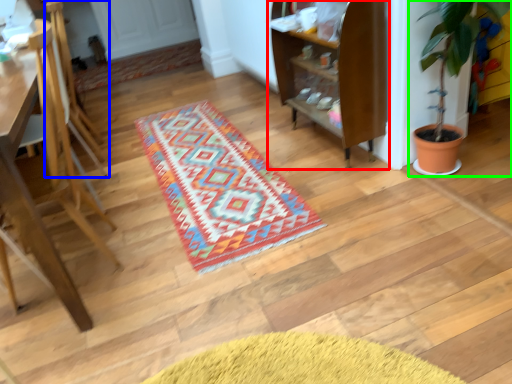
Question: Which object is positioned farthest from shelf (highlighted by a red box)? Select from armchair (highlighted by a blue box) and houseplant (highlighted by a green box).

Choices:
 (A) armchair
 (B) houseplant

Answer: (A)